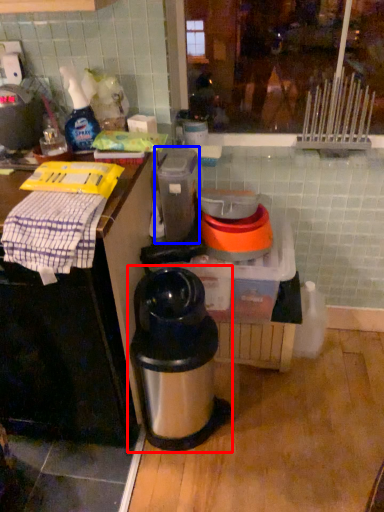
Question: Which of the following is the closest to the observer, waste container (highlighted by a red box) or appliance (highlighted by a blue box)?

Choices:
 (A) waste container
 (B) appliance

Answer: (A)